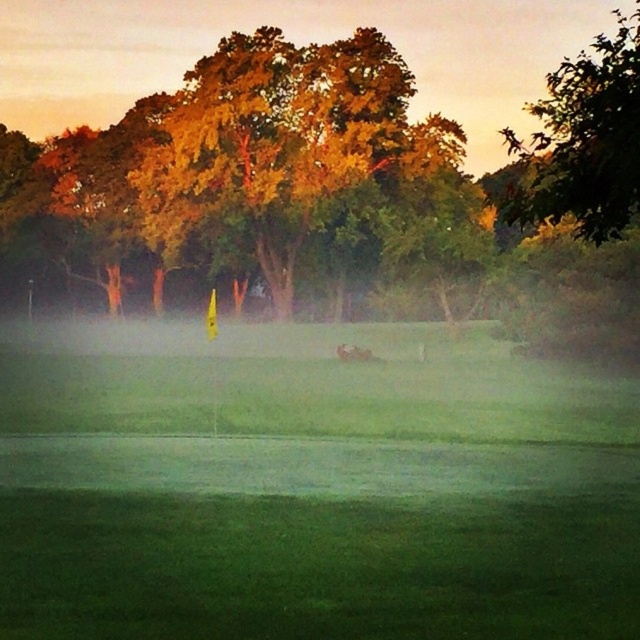
From the picture: You are a golfer standing on the green grassy field at center and want to hit a ball towards the green leafy tree at upper right. Considering their heights, will the tree block your view of the ball once it reaches the tree?

The green leafy tree at upper right is taller than the green grassy field at center, so yes, the tree may block your view of the ball once it reaches the tree.

You are standing at the point marked as point (61, 420) on the golf course. If you want to take a photo of the entire scene including the distant trees, which direction should you move to ensure the camera can capture everything in one shot?

Result: You should move away from the camera because the point (61, 420) is 120.32 feet away from the camera, so moving further back would allow the camera to capture the entire scene including the distant trees in one shot.